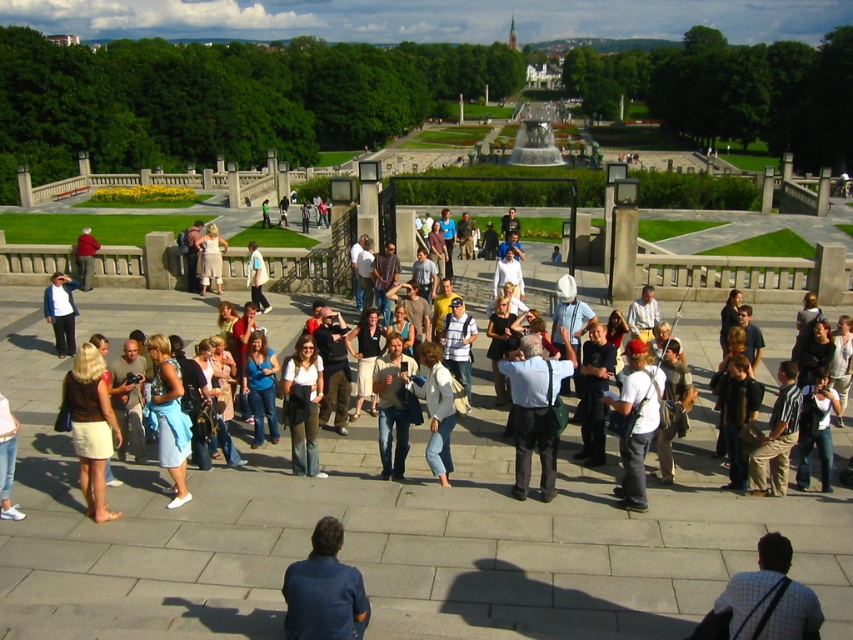
You are a photographer standing in the park and notice two people in the crowd wearing denim pants at center and light beige dress at center. Which clothing item is positioned lower in the image?

The denim pants at center is below light beige dress at center, so the denim pants at center is positioned lower in the image.

You are standing in the park and want to take a photo of both point (x=254, y=433) and point (x=258, y=292) in the scene. Which point should you focus on first to ensure both are in clear view?

You should focus on point (x=254, y=433) first because it is closer to the camera than point (x=258, y=292), ensuring both points are in focus when using a camera with a fixed focal length.